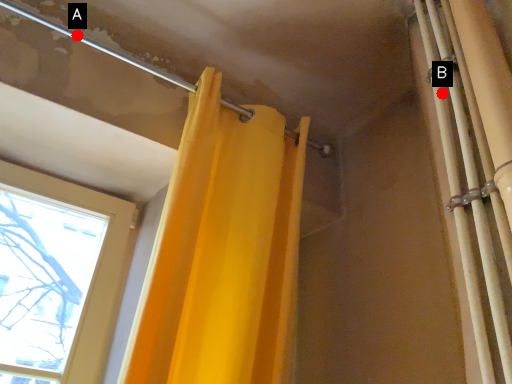
Question: Two points are circled on the image, labeled by A and B beside each circle. Among these points, which one is nearest to the camera?

Choices:
 (A) A is closer
 (B) B is closer

Answer: (B)